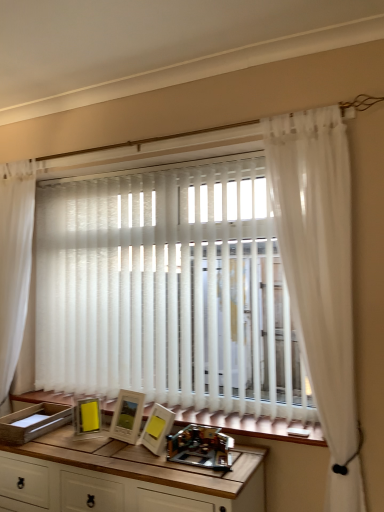
Question: Is wooden table at center inside or outside of white sheer curtain at left, which is counted as the 1th curtain, starting from the back?

Choices:
 (A) inside
 (B) outside

Answer: (B)

Question: From a real-world perspective, is wooden table at center physically located above or below white sheer curtain at left, which is counted as the 1th curtain, starting from the back?

Choices:
 (A) below
 (B) above

Answer: (A)

Question: Which of these objects is positioned farthest from the wooden at lower center?

Choices:
 (A) metallic plastic toy at center
 (B) white sheer curtain at left, which ranks as the 2th curtain in right-to-left order
 (C) metallic silver picture frame at lower left, the 3th picture frame when ordered from right to left
 (D) wooden table at center
 (E) matte white picture frame at center, placed as the second picture frame when sorted from left to right

Answer: (B)

Question: Estimate the real-world distances between objects in this image. Which object is closer to the metallic silver picture frame at lower left, which is the first picture frame in left-to-right order?

Choices:
 (A) wooden at lower center
 (B) white sheer curtain at right, which is the first curtain from front to back
 (C) wooden table at center
 (D) white sheer curtain at left, which is counted as the 1th curtain, starting from the back
 (E) matte white picture frame at center, placed as the second picture frame when sorted from left to right

Answer: (E)